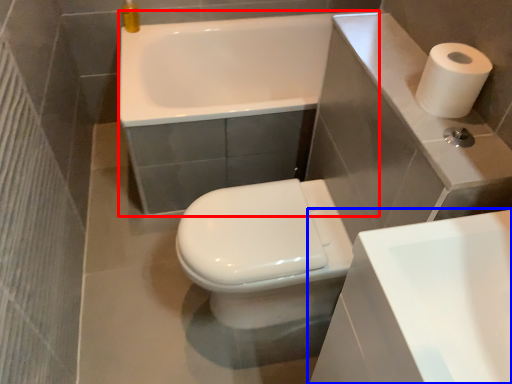
Question: Among these objects, which one is farthest to the camera, bath (highlighted by a red box) or sink (highlighted by a blue box)?

Choices:
 (A) bath
 (B) sink

Answer: (A)